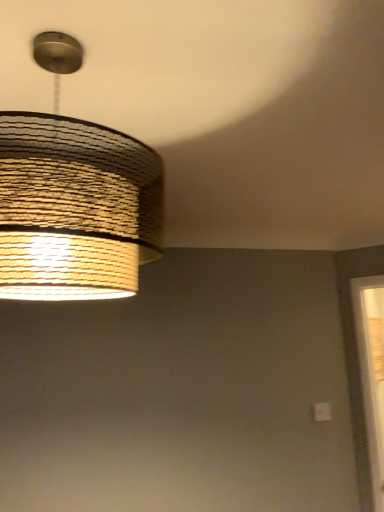
Question: Should I look upward or downward to see woven paper lampshade at upper left?

Choices:
 (A) down
 (B) up

Answer: (B)